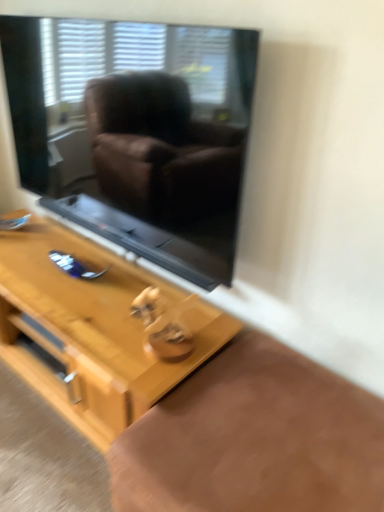
What do you see at coordinates (136, 132) in the screenshot? The height and width of the screenshot is (512, 384). I see `black glass window screen at upper center` at bounding box center [136, 132].

You are a GUI agent. You are given a task and a screenshot of the screen. Output one action in this format:
    pyautogui.click(x=<x>, y=<y>)
    Task: Click on the black glass window screen at upper center
    This screenshot has height=512, width=384.
    Given the screenshot: What is the action you would take?
    pyautogui.click(x=136, y=132)

Measure the distance between light wood table at center and camera.

light wood table at center is 3.78 feet away from camera.

This screenshot has width=384, height=512. I want to click on light wood table at center, so click(98, 329).

What do you see at coordinates (98, 329) in the screenshot? Image resolution: width=384 pixels, height=512 pixels. I see `light wood table at center` at bounding box center [98, 329].

Find the location of a particular element. This screenshot has height=512, width=384. black glass window screen at upper center is located at coordinates (136, 132).

Which is more to the right, light wood table at center or black glass window screen at upper center?

From the viewer's perspective, black glass window screen at upper center appears more on the right side.

Which object is further away from the camera, light wood table at center or black glass window screen at upper center?

light wood table at center is more distant.

Between point (17, 293) and point (174, 80), which one is positioned behind?

The point (17, 293) is behind.

From the image's perspective, is light wood table at center below black glass window screen at upper center?

Correct, light wood table at center appears lower than black glass window screen at upper center in the image.

From a real-world perspective, which is physically above, light wood table at center or black glass window screen at upper center?

black glass window screen at upper center, from a real-world perspective.

Based on the photo, can you confirm if light wood table at center is wider than black glass window screen at upper center?

Yes, light wood table at center is wider than black glass window screen at upper center.

Consider the image. Considering the sizes of objects light wood table at center and black glass window screen at upper center in the image provided, who is shorter, light wood table at center or black glass window screen at upper center?

With less height is light wood table at center.

Which of these two, light wood table at center or black glass window screen at upper center, is bigger?

light wood table at center is bigger.

Is light wood table at center spatially inside black glass window screen at upper center, or outside of it?

light wood table at center is not inside black glass window screen at upper center, it's outside.

Are light wood table at center and black glass window screen at upper center far apart?

Actually, light wood table at center and black glass window screen at upper center are a little close together.

Is light wood table at center looking in the opposite direction of black glass window screen at upper center?

No, light wood table at center is not facing the opposite direction of black glass window screen at upper center.

How different are the orientations of light wood table at center and black glass window screen at upper center in degrees?

The angular difference between light wood table at center and black glass window screen at upper center is 0.169 degrees.

How far apart are light wood table at center and black glass window screen at upper center?

light wood table at center is 16.77 inches away from black glass window screen at upper center.

Locate an element on the screen. The image size is (384, 512). table that is behind the black glass window screen at upper center is located at coordinates (98, 329).

Based on the photo, between black glass window screen at upper center and light wood table at center, which one appears on the right side from the viewer's perspective?

black glass window screen at upper center.

Between black glass window screen at upper center and light wood table at center, which one is positioned in front?

black glass window screen at upper center is closer to the camera.

Which is closer, (85, 84) or (5, 303)?

The point (85, 84) is closer to the camera.

From the image's perspective, which is above, black glass window screen at upper center or light wood table at center?

From the image's view, black glass window screen at upper center is above.

From a real-world perspective, does black glass window screen at upper center stand above light wood table at center?

Yes, from a real-world perspective, black glass window screen at upper center is on top of light wood table at center.

Which object is wider, black glass window screen at upper center or light wood table at center?

Wider between the two is light wood table at center.

Between black glass window screen at upper center and light wood table at center, which one has more height?

black glass window screen at upper center is taller.

Does black glass window screen at upper center have a larger size compared to light wood table at center?

No.

Consider the image. Is black glass window screen at upper center positioned beyond the bounds of light wood table at center?

black glass window screen at upper center is positioned outside light wood table at center.

Is black glass window screen at upper center placed right next to light wood table at center?

black glass window screen at upper center and light wood table at center are clearly separated.

Is black glass window screen at upper center aimed at light wood table at center?

No, black glass window screen at upper center is not oriented towards light wood table at center.

From the picture: How much distance is there between black glass window screen at upper center and light wood table at center?

The distance of black glass window screen at upper center from light wood table at center is 16.77 inches.

This screenshot has width=384, height=512. I want to click on window screen that appears on the right of light wood table at center, so click(x=136, y=132).

This screenshot has height=512, width=384. I want to click on window screen on the right side of light wood table at center, so click(136, 132).

The image size is (384, 512). I want to click on table below the black glass window screen at upper center (from a real-world perspective), so click(x=98, y=329).